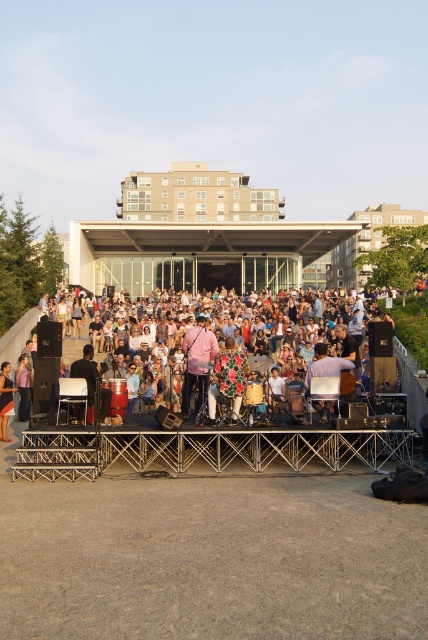
Is pink floral shirt at center thinner than light brown wooden chair at center?

Incorrect, pink floral shirt at center's width is not less than light brown wooden chair at center's.

Is pink floral shirt at center to the right of light brown wooden chair at center from the viewer's perspective?

Incorrect, pink floral shirt at center is not on the right side of light brown wooden chair at center.

Does point (415, 378) lie behind point (347, 358)?

Yes, point (415, 378) is behind point (347, 358).

I want to click on pink floral shirt at center, so click(x=217, y=333).

Does beige concrete amphitheater at center have a smaller size compared to matte black jacket at lower left?

Actually, beige concrete amphitheater at center might be larger than matte black jacket at lower left.

What do you see at coordinates (196, 236) in the screenshot?
I see `beige concrete amphitheater at center` at bounding box center [196, 236].

I want to click on beige concrete amphitheater at center, so click(x=196, y=236).

Who is more distant from viewer, (199, 346) or (104, 403)?

Point (199, 346)

Is point (181, 410) positioned behind point (74, 369)?

That is True.

The width and height of the screenshot is (428, 640). I want to click on pink cotton shirt at center, so click(196, 362).